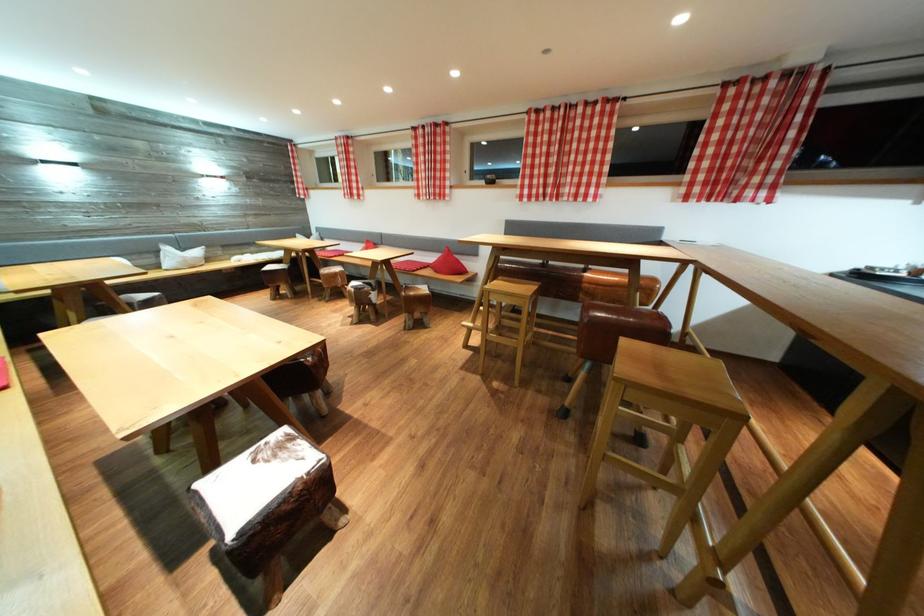
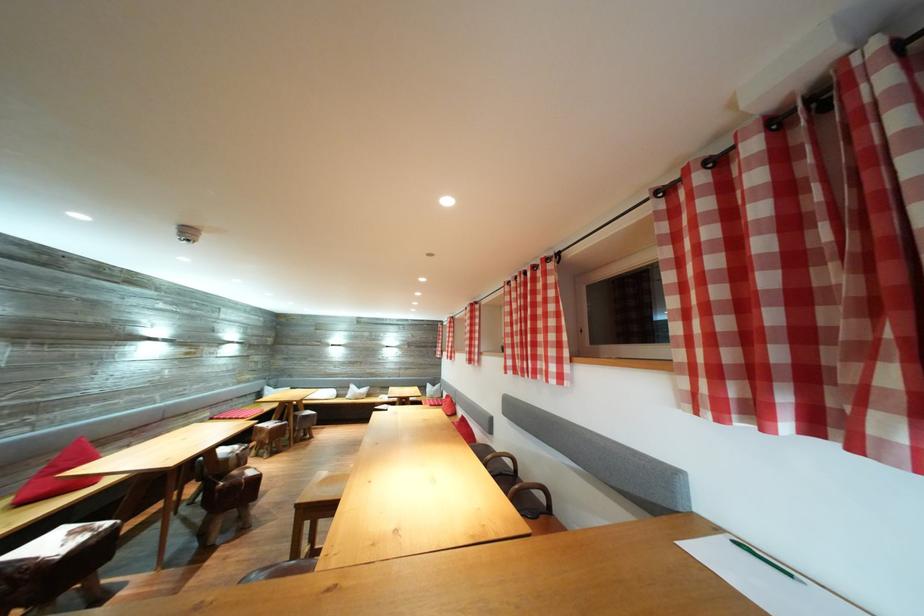
Locate, in the second image, the point that corresponds to [760,87] in the first image.

(725, 166)